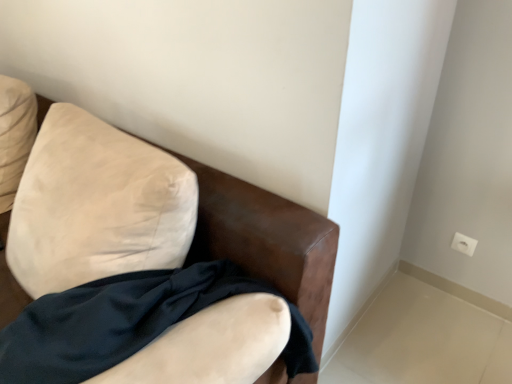
Question: Is satin black fabric at lower left not inside suede-like beige armchair at upper left?

Choices:
 (A) no
 (B) yes

Answer: (A)

Question: Does satin black fabric at lower left appear on the left side of suede-like beige armchair at upper left?

Choices:
 (A) yes
 (B) no

Answer: (B)

Question: Does satin black fabric at lower left appear on the right side of suede-like beige armchair at upper left?

Choices:
 (A) no
 (B) yes

Answer: (B)

Question: Does satin black fabric at lower left lie in front of suede-like beige armchair at upper left?

Choices:
 (A) yes
 (B) no

Answer: (B)

Question: From the image's perspective, would you say satin black fabric at lower left is positioned over suede-like beige armchair at upper left?

Choices:
 (A) no
 (B) yes

Answer: (A)

Question: From a real-world perspective, is satin black fabric at lower left above or below suede-like beige armchair at upper left?

Choices:
 (A) below
 (B) above

Answer: (B)

Question: Considering the positions of satin black fabric at lower left and suede-like beige armchair at upper left in the image, is satin black fabric at lower left taller or shorter than suede-like beige armchair at upper left?

Choices:
 (A) tall
 (B) short

Answer: (B)

Question: From the image's perspective, is satin black fabric at lower left located above or below suede-like beige armchair at upper left?

Choices:
 (A) below
 (B) above

Answer: (A)

Question: Looking at their shapes, would you say satin black fabric at lower left is wider or thinner than suede-like beige armchair at upper left?

Choices:
 (A) wide
 (B) thin

Answer: (B)

Question: Considering the positions of suede-like beige armchair at upper left and white plastic electric outlet at upper right in the image, is suede-like beige armchair at upper left wider or thinner than white plastic electric outlet at upper right?

Choices:
 (A) wide
 (B) thin

Answer: (A)

Question: From a real-world perspective, relative to white plastic electric outlet at upper right, is suede-like beige armchair at upper left vertically above or below?

Choices:
 (A) above
 (B) below

Answer: (A)

Question: Is suede-like beige armchair at upper left inside or outside of white plastic electric outlet at upper right?

Choices:
 (A) outside
 (B) inside

Answer: (A)

Question: In the image, is suede-like beige armchair at upper left positioned in front of or behind white plastic electric outlet at upper right?

Choices:
 (A) front
 (B) behind

Answer: (A)

Question: In the image, is white plastic electric outlet at upper right on the left side or the right side of suede-like beige armchair at upper left?

Choices:
 (A) right
 (B) left

Answer: (A)

Question: From a real-world perspective, is white plastic electric outlet at upper right above or below suede-like beige armchair at upper left?

Choices:
 (A) above
 (B) below

Answer: (B)